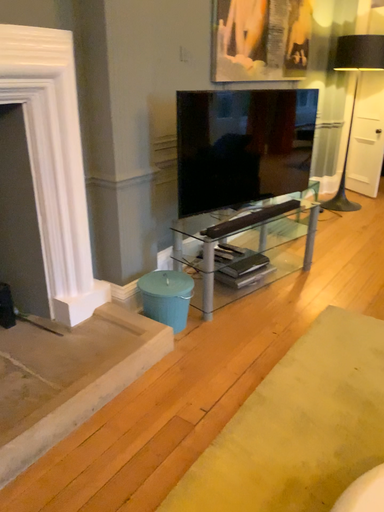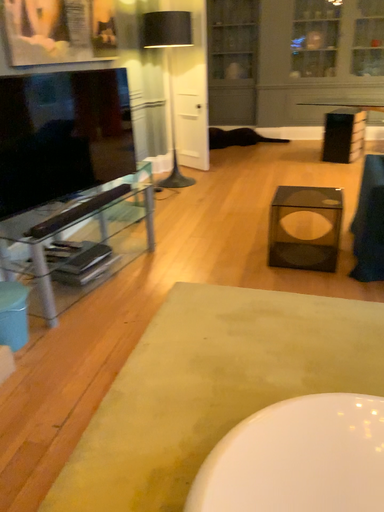
Question: Which way did the camera rotate in the video?

Choices:
 (A) rotated right
 (B) rotated left

Answer: (A)